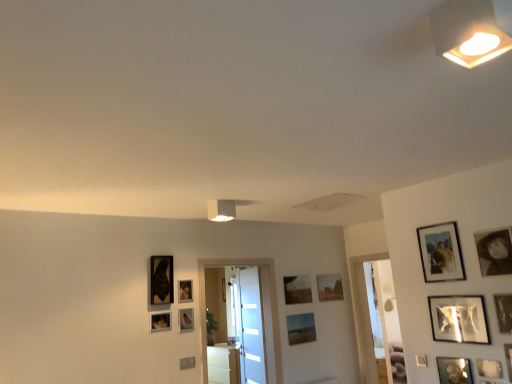
Question: Can you confirm if matte glass picture frame at center, which is counted as the 12th picture frame, starting from the front, is wider than matte black picture frame at left, the 14th picture frame in the right-to-left sequence?

Choices:
 (A) no
 (B) yes

Answer: (A)

Question: From the image's perspective, does matte glass picture frame at center, which ranks as the ninth picture frame in right-to-left order, appear lower than matte black picture frame at left, acting as the sixth picture frame starting from the back?

Choices:
 (A) no
 (B) yes

Answer: (B)

Question: Is matte glass picture frame at center, arranged as the 6th picture frame when viewed from the left, in front of matte black picture frame at left, acting as the first picture frame starting from the left?

Choices:
 (A) no
 (B) yes

Answer: (A)

Question: Is matte glass picture frame at center, which ranks as the ninth picture frame in right-to-left order, smaller than matte black picture frame at left, marked as the 9th picture frame in a front-to-back arrangement?

Choices:
 (A) yes
 (B) no

Answer: (A)

Question: Is matte glass picture frame at center, arranged as the 6th picture frame when viewed from the left, to the right of matte black picture frame at left, acting as the first picture frame starting from the left, from the viewer's perspective?

Choices:
 (A) no
 (B) yes

Answer: (B)

Question: Considering the positions of matte glass picture frame at center, arranged as the 6th picture frame when viewed from the left, and matte black picture frame at center, which is the 4th picture frame from back to front, in the image, is matte glass picture frame at center, arranged as the 6th picture frame when viewed from the left, taller or shorter than matte black picture frame at center, which is the 4th picture frame from back to front,?

Choices:
 (A) tall
 (B) short

Answer: (A)

Question: Choose the correct answer: Is matte glass picture frame at center, arranged as the 6th picture frame when viewed from the left, inside matte black picture frame at center, the 3th picture frame when ordered from left to right, or outside it?

Choices:
 (A) outside
 (B) inside

Answer: (A)

Question: From a real-world perspective, is matte glass picture frame at center, which is counted as the 12th picture frame, starting from the front, above or below matte black picture frame at center, the 3th picture frame when ordered from left to right?

Choices:
 (A) above
 (B) below

Answer: (B)

Question: Is matte glass picture frame at center, which ranks as the ninth picture frame in right-to-left order, bigger or smaller than matte black picture frame at center, marked as the eleventh picture frame in a front-to-back arrangement?

Choices:
 (A) big
 (B) small

Answer: (A)

Question: In the image, is matte black picture frame at center, the 3th picture frame when ordered from left to right, on the left side or the right side of matte black picture frame at upper right, which is the eleventh picture frame from left to right?

Choices:
 (A) right
 (B) left

Answer: (B)

Question: In terms of width, does matte black picture frame at center, the 3th picture frame when ordered from left to right, look wider or thinner when compared to matte black picture frame at upper right, which is the eleventh picture frame from left to right?

Choices:
 (A) wide
 (B) thin

Answer: (A)

Question: Relative to matte black picture frame at upper right, which is the eleventh picture frame from left to right, is matte black picture frame at center, marked as the eleventh picture frame in a front-to-back arrangement, in front or behind?

Choices:
 (A) behind
 (B) front

Answer: (A)

Question: Is matte black picture frame at center, which is the 4th picture frame from back to front, spatially inside matte black picture frame at upper right, placed as the eleventh picture frame when sorted from back to front, or outside of it?

Choices:
 (A) inside
 (B) outside

Answer: (B)

Question: In terms of height, does metallic reflective picture frame at right, which is counted as the 5th picture frame, starting from the front, look taller or shorter compared to transparent glass door at center, positioned as the second glass door in right-to-left order?

Choices:
 (A) tall
 (B) short

Answer: (B)

Question: In terms of width, does metallic reflective picture frame at right, which is counted as the tenth picture frame, starting from the left, look wider or thinner when compared to transparent glass door at center, the 2th glass door from the left?

Choices:
 (A) wide
 (B) thin

Answer: (B)